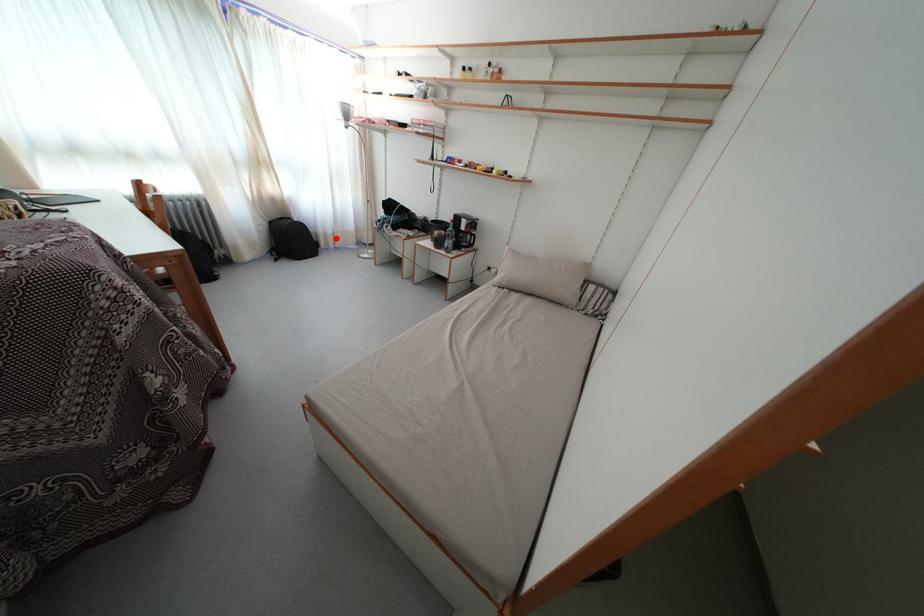
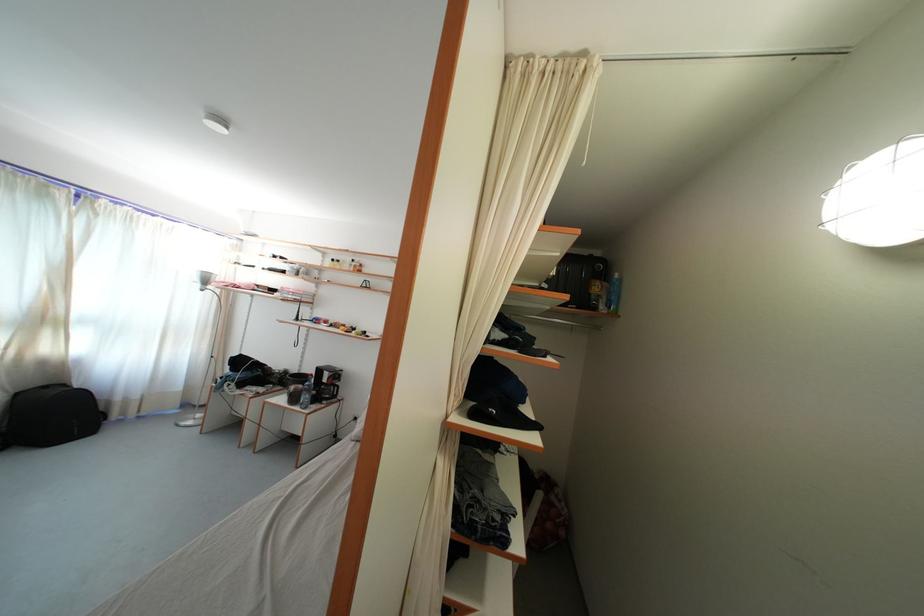
Question: I am providing you with two images of the same scene from different viewpoints. In image1, a red point is highlighted. Considering the same 3D point in image2, which of the following is correct?

Choices:
 (A) It is closer
 (B) It is farther

Answer: (B)